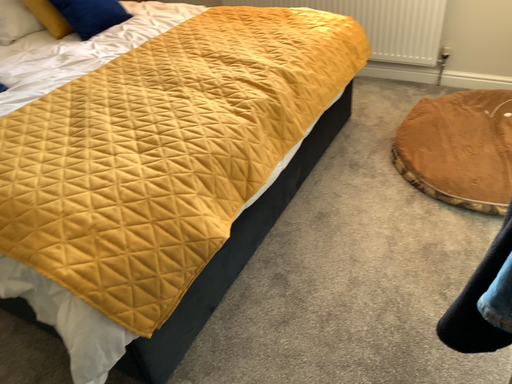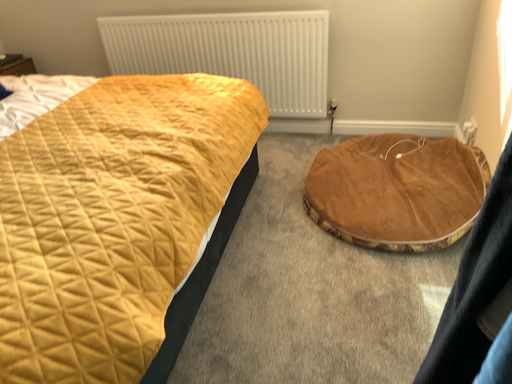
Question: Which way did the camera rotate in the video?

Choices:
 (A) rotated left
 (B) rotated right

Answer: (B)